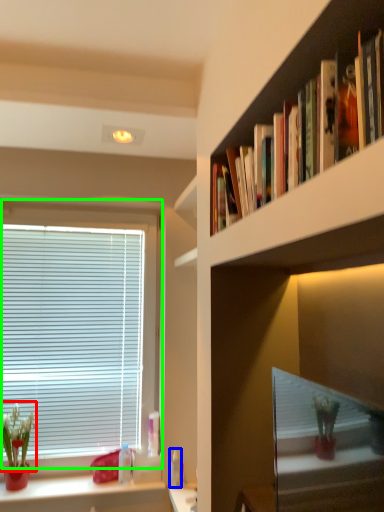
Question: Which object is positioned closest to floral arrangement (highlighted by a red box)? Select from toiletry (highlighted by a blue box) and window (highlighted by a green box).

Choices:
 (A) toiletry
 (B) window

Answer: (B)